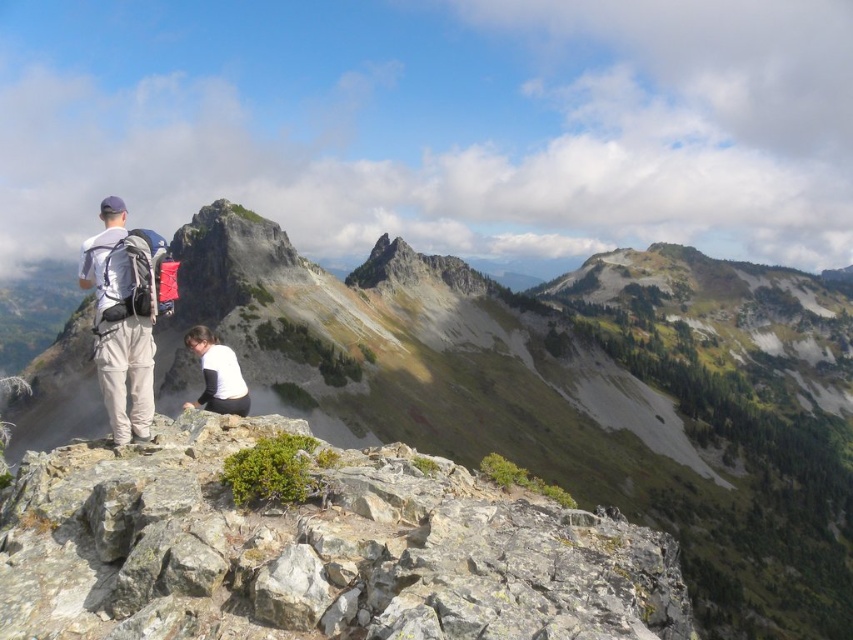
You are standing at point (154, 484) and want to move to point (621, 264). Which direction should you move in relation to the rocky outcrop?

You should move towards the back of the rocky outcrop to reach point (621, 264) from point (154, 484) since it is located behind it.